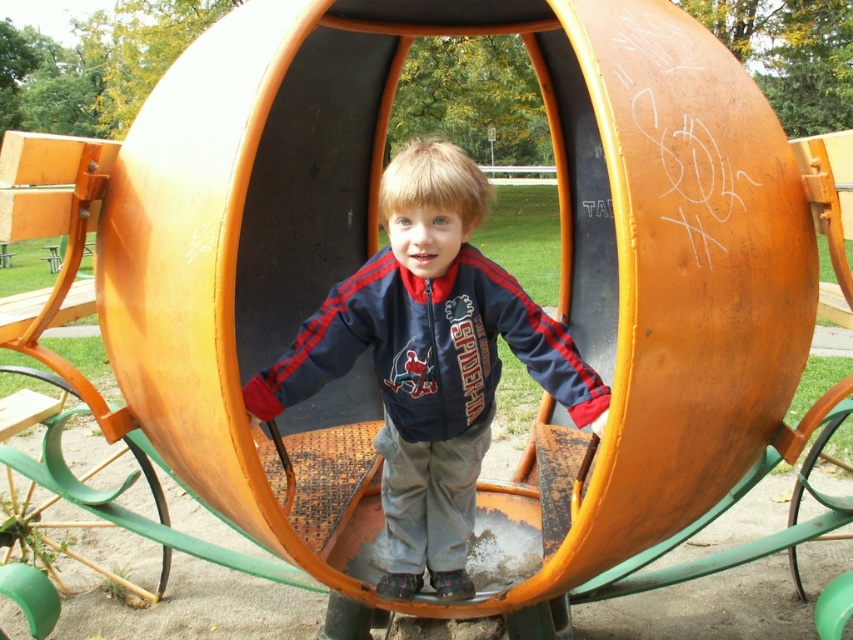
Question: Is matte orange swing at center behind navy blue fleece sweatshirt at center?

Choices:
 (A) yes
 (B) no

Answer: (B)

Question: Is matte orange swing at center wider than navy blue fleece sweatshirt at center?

Choices:
 (A) no
 (B) yes

Answer: (A)

Question: Which of the following is the closest to the observer?

Choices:
 (A) (437, 513)
 (B) (482, 378)

Answer: (B)

Question: Considering the relative positions of matte orange swing at center and navy blue fleece sweatshirt at center in the image provided, where is matte orange swing at center located with respect to navy blue fleece sweatshirt at center?

Choices:
 (A) below
 (B) above

Answer: (A)

Question: Among these objects, which one is farthest from the camera?

Choices:
 (A) matte orange swing at center
 (B) navy blue fleece sweatshirt at center

Answer: (B)

Question: Which point is farther from the camera taking this photo?

Choices:
 (A) (439, 186)
 (B) (437, 380)

Answer: (B)